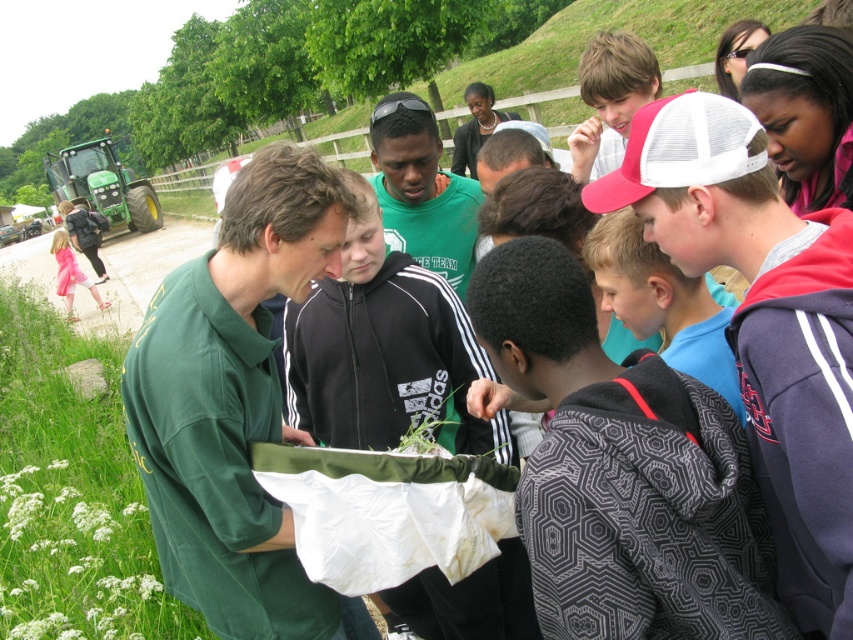
Question: Is black adidas tracksuit at center thinner than green matte shirt at center?

Choices:
 (A) no
 (B) yes

Answer: (A)

Question: Is white mesh cap at center positioned before black adidas tracksuit at center?

Choices:
 (A) no
 (B) yes

Answer: (B)

Question: Estimate the real-world distances between objects in this image. Which object is closer to the patterned fabric jacket at center?

Choices:
 (A) pink fabric dress at lower left
 (B) white mesh cap at center
 (C) green matte shirt at center
 (D) blue cotton shirt at center

Answer: (B)

Question: Which object is closer to the camera taking this photo?

Choices:
 (A) pink fabric dress at lower left
 (B) green matte shirt at center
 (C) green leafy vegetable at center

Answer: (C)

Question: Can you confirm if white mesh cap at center is positioned above green leafy vegetable at center?

Choices:
 (A) no
 (B) yes

Answer: (B)

Question: Which point is farther from the camera taking this photo?

Choices:
 (A) (640, 300)
 (B) (605, 426)
 (C) (320, 396)

Answer: (C)